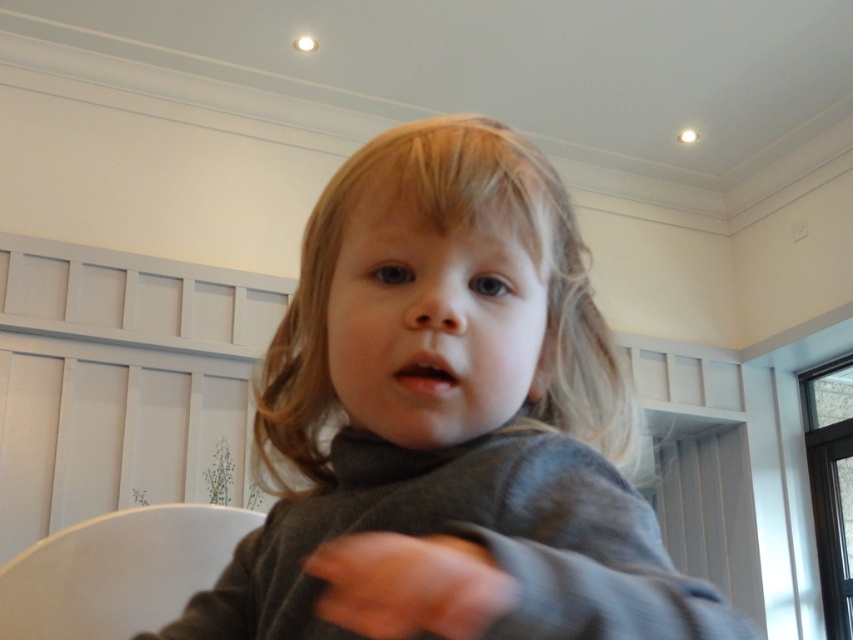
You are a photographer setting up a shoot in the room. You notice the blonde silky hair at center and the smooth gray hand at center. Which object is positioned higher in the image?

The blonde silky hair at center is above the smooth gray hand at center, so the blonde silky hair at center is positioned higher in the image.

You are a photographer setting up for a portrait. You have a backdrop that can only accommodate objects up to the width of the white plastic chair at lower left. Will the blonde silky hair at center fit within this backdrop?

The blonde silky hair at center is wider than the white plastic chair at lower left, so it will not fit within the backdrop designed for the chair.